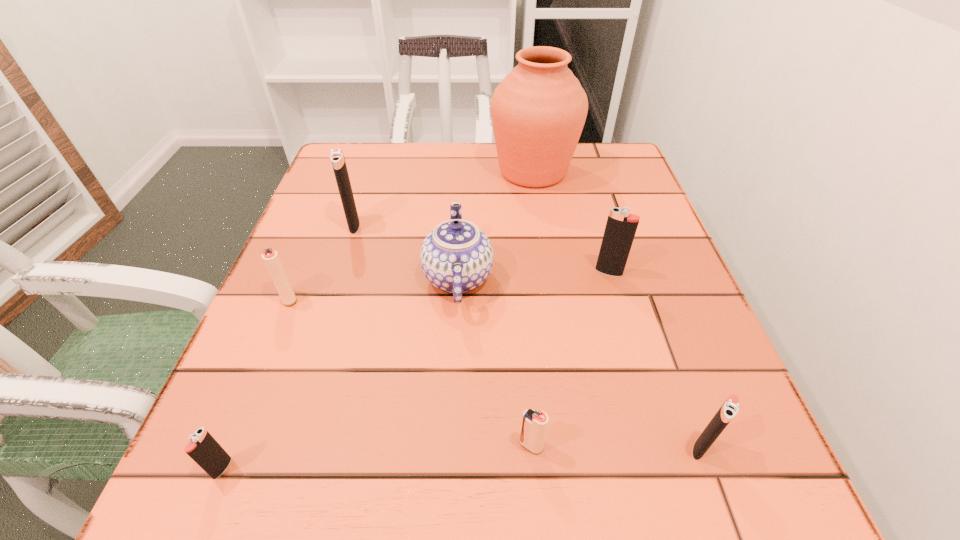
Find the location of a particular element. This screenshot has height=540, width=960. vacant region between the smaller red igniter and the biggest black igniter is located at coordinates (443, 335).

Locate an element on the screen. The height and width of the screenshot is (540, 960). free space between the rightmost object and the seventh nearest object is located at coordinates (527, 336).

You are a GUI agent. You are given a task and a screenshot of the screen. Output one action in this format:
    pyautogui.click(x=<x>, y=<y>)
    Task: Click on the vacant area that lies between the fourth object from left to right and the tallest object
    This screenshot has height=540, width=960.
    Given the screenshot: What is the action you would take?
    pyautogui.click(x=495, y=224)

Identify the location of blank region between the farthest black igniter and the rightmost object. (527, 336).

Identify the location of the seventh closest object to the brown urn. Image resolution: width=960 pixels, height=540 pixels. tap(203, 448).

Identify the location of object identified as the seventh closest to the bigger red igniter. Image resolution: width=960 pixels, height=540 pixels. (729, 409).

Choose which igniter is the third nearest neighbor to the rightmost object. Please provide its 2D coordinates. Your answer should be formatted as a tuple, i.e. [(x, y)], where the tuple contains the x and y coordinates of a point satisfying the conditions above.

[(203, 448)]

The width and height of the screenshot is (960, 540). Find the location of `igniter that is the fourth closest to the sixth object from right to left`. igniter that is the fourth closest to the sixth object from right to left is located at coordinates (534, 423).

Locate which black igniter is the third closest to the tallest object. Please provide its 2D coordinates. Your answer should be formatted as a tuple, i.e. [(x, y)], where the tuple contains the x and y coordinates of a point satisfying the conditions above.

[(729, 409)]

Identify which black igniter is located as the nearest to the right red igniter. Please provide its 2D coordinates. Your answer should be formatted as a tuple, i.e. [(x, y)], where the tuple contains the x and y coordinates of a point satisfying the conditions above.

[(729, 409)]